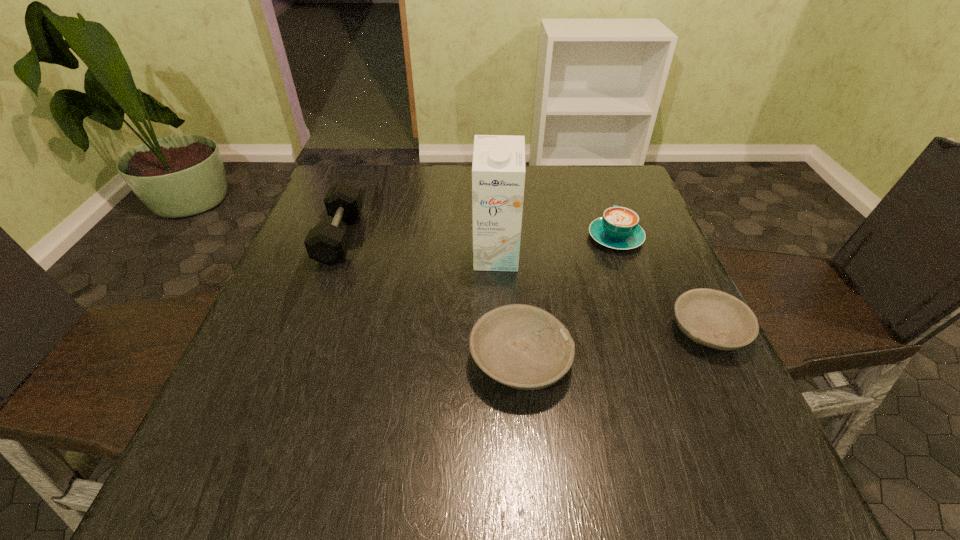
Select which object appears as the second closest to the right bowl. Please provide its 2D coordinates. Your answer should be formatted as a tuple, i.e. [(x, y)], where the tuple contains the x and y coordinates of a point satisfying the conditions above.

[(521, 346)]

Find the location of a particular element. The height and width of the screenshot is (540, 960). object that stands as the second closest to the tallest object is located at coordinates (618, 229).

This screenshot has height=540, width=960. Find the location of `vacant position in the image that satisfies the following two spatial constraints: 1. on the back side of the right bowl; 2. on the left side of the taller bowl`. vacant position in the image that satisfies the following two spatial constraints: 1. on the back side of the right bowl; 2. on the left side of the taller bowl is located at coordinates pos(518,330).

This screenshot has height=540, width=960. I want to click on vacant space that satisfies the following two spatial constraints: 1. on the front side of the leftmost object; 2. on the right side of the tallest object, so click(333, 257).